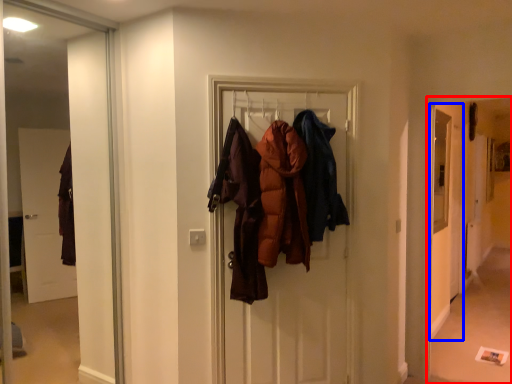
Question: Among these objects, which one is farthest to the camera, corridor (highlighted by a red box) or screen door (highlighted by a blue box)?

Choices:
 (A) corridor
 (B) screen door

Answer: (B)